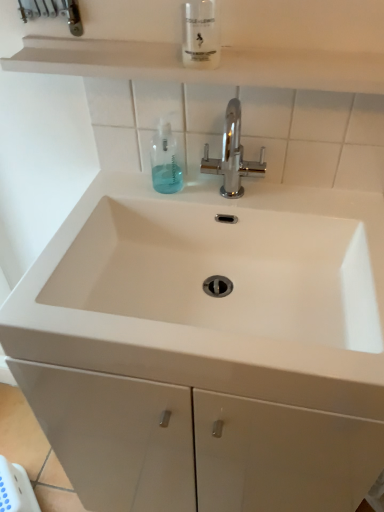
Measure the distance between point (334, 68) and camera.

Point (334, 68) is 26.42 inches away from camera.

Where is `translucent plastic mouthwash at center, which is counted as the 2th mouthwash, starting from the right`? The width and height of the screenshot is (384, 512). translucent plastic mouthwash at center, which is counted as the 2th mouthwash, starting from the right is located at coordinates (165, 160).

The width and height of the screenshot is (384, 512). What do you see at coordinates (201, 34) in the screenshot?
I see `clear plastic bottle at upper center, which is the 2th mouthwash from bottom to top` at bounding box center [201, 34].

Describe the element at coordinates (225, 271) in the screenshot. The height and width of the screenshot is (512, 384). I see `white matte sink at center` at that location.

Where is `white matte shelf at upper center`? white matte shelf at upper center is located at coordinates (201, 69).

Is white matte sink at center at the back of translucent plastic mouthwash at center, the first mouthwash ordered from the bottom?

No, translucent plastic mouthwash at center, the first mouthwash ordered from the bottom, is not facing the opposite direction of white matte sink at center.

Is translucent plastic mouthwash at center, acting as the 1th mouthwash starting from the left, wider than white matte sink at center?

No.

The image size is (384, 512). I want to click on sink that appears below the translucent plastic mouthwash at center, which is counted as the 2th mouthwash, starting from the right (from the image's perspective), so click(225, 271).

Looking at this image, can you confirm if translucent plastic mouthwash at center, acting as the 1th mouthwash starting from the left, is taller than white matte sink at center?

Yes, translucent plastic mouthwash at center, acting as the 1th mouthwash starting from the left, is taller than white matte sink at center.

Is chrome metallic faucet at center touching white matte sink at center?

No, chrome metallic faucet at center is not in contact with white matte sink at center.

Which object is positioned more to the right, chrome metallic faucet at center or white matte sink at center?

Positioned to the right is chrome metallic faucet at center.

From the image's perspective, which is above, chrome metallic faucet at center or white matte sink at center?

chrome metallic faucet at center is shown above in the image.

From a real-world perspective, which object stands above the other?

From a 3D spatial view, chrome metallic faucet at center is above.

Is clear plastic bottle at upper center, the second mouthwash viewed from the left, located outside translucent plastic mouthwash at center, which is counted as the 2th mouthwash, starting from the right?

clear plastic bottle at upper center, the second mouthwash viewed from the left, lies outside translucent plastic mouthwash at center, which is counted as the 2th mouthwash, starting from the right,'s area.

From the picture: Which is behind, clear plastic bottle at upper center, the first mouthwash from the front, or translucent plastic mouthwash at center, which is counted as the 1th mouthwash, starting from the back?

Positioned behind is translucent plastic mouthwash at center, which is counted as the 1th mouthwash, starting from the back.

Which is less distant, (207, 23) or (165, 131)?

The point (207, 23) is in front.

Is clear plastic bottle at upper center, which is the first mouthwash from top to bottom, placed right next to translucent plastic mouthwash at center, placed as the 2th mouthwash when sorted from top to bottom?

clear plastic bottle at upper center, which is the first mouthwash from top to bottom, is not next to translucent plastic mouthwash at center, placed as the 2th mouthwash when sorted from top to bottom, and they're not touching.

Does point (155, 271) come farther from viewer compared to point (353, 77)?

Yes, point (155, 271) is behind point (353, 77).

Who is more distant, white matte sink at center or white matte shelf at upper center?

white matte shelf at upper center is further from the camera.

In terms of width, does white matte sink at center look wider or thinner when compared to white matte shelf at upper center?

white matte sink at center is wider than white matte shelf at upper center.

From a real-world perspective, which is physically below, white matte sink at center or white matte shelf at upper center?

white matte sink at center.

Which object is positioned more to the left, chrome metallic faucet at center or clear plastic bottle at upper center, which is the 2th mouthwash from bottom to top?

clear plastic bottle at upper center, which is the 2th mouthwash from bottom to top.

Locate an element on the screen. tap located below the clear plastic bottle at upper center, the second mouthwash viewed from the left (from the image's perspective) is located at coordinates (232, 155).

From the image's perspective, is chrome metallic faucet at center located beneath clear plastic bottle at upper center, the 2th mouthwash positioned from the back?

Yes.

Is point (223, 137) less distant than point (214, 44)?

No, it is not.

Is chrome metallic faucet at center in front of or behind translucent plastic mouthwash at center, positioned as the second mouthwash in front-to-back order, in the image?

chrome metallic faucet at center is positioned closer to the viewer than translucent plastic mouthwash at center, positioned as the second mouthwash in front-to-back order.

From a real-world perspective, which object stands above the other?

From a 3D spatial view, chrome metallic faucet at center is above.

Is chrome metallic faucet at center at the right side of translucent plastic mouthwash at center, positioned as the second mouthwash in front-to-back order?

Indeed, chrome metallic faucet at center is positioned on the right side of translucent plastic mouthwash at center, positioned as the second mouthwash in front-to-back order.

Considering the sizes of objects chrome metallic faucet at center and translucent plastic mouthwash at center, which is counted as the 2th mouthwash, starting from the right, in the image provided, who is thinner, chrome metallic faucet at center or translucent plastic mouthwash at center, which is counted as the 2th mouthwash, starting from the right,?

Thinner between the two is translucent plastic mouthwash at center, which is counted as the 2th mouthwash, starting from the right.

Between clear plastic bottle at upper center, the first mouthwash from the front, and white matte shelf at upper center, which one appears on the right side from the viewer's perspective?

From the viewer's perspective, clear plastic bottle at upper center, the first mouthwash from the front, appears more on the right side.

Is the depth of clear plastic bottle at upper center, the first mouthwash from the front, greater than that of white matte shelf at upper center?

That is False.

From the image's perspective, which one is positioned higher, clear plastic bottle at upper center, which is the 1th mouthwash in right-to-left order, or white matte shelf at upper center?

clear plastic bottle at upper center, which is the 1th mouthwash in right-to-left order.

Where is `sink in front of the translucent plastic mouthwash at center, the first mouthwash ordered from the bottom`? Image resolution: width=384 pixels, height=512 pixels. sink in front of the translucent plastic mouthwash at center, the first mouthwash ordered from the bottom is located at coordinates (225, 271).

You are a GUI agent. You are given a task and a screenshot of the screen. Output one action in this format:
    pyautogui.click(x=<x>, y=<y>)
    Task: Click on the sink that is on the left side of chrome metallic faucet at center
    This screenshot has width=384, height=512.
    Given the screenshot: What is the action you would take?
    (x=225, y=271)

From the image, which object appears to be farther from white matte sink at center, white matte shelf at upper center or translucent plastic mouthwash at center, which is counted as the 1th mouthwash, starting from the back?

white matte shelf at upper center is positioned further to the anchor white matte sink at center.

When comparing their distances from chrome metallic faucet at center, does white matte shelf at upper center or translucent plastic mouthwash at center, acting as the 1th mouthwash starting from the left, seem closer?

translucent plastic mouthwash at center, acting as the 1th mouthwash starting from the left, is closer to chrome metallic faucet at center.

Looking at the image, which one is located closer to white matte sink at center, clear plastic bottle at upper center, the 2th mouthwash positioned from the back, or chrome metallic faucet at center?

chrome metallic faucet at center is positioned closer to the anchor white matte sink at center.

In the scene shown: Which object lies further to the anchor point chrome metallic faucet at center, clear plastic bottle at upper center, the second mouthwash viewed from the left, or translucent plastic mouthwash at center, acting as the 1th mouthwash starting from the left?

Among the two, clear plastic bottle at upper center, the second mouthwash viewed from the left, is located further to chrome metallic faucet at center.

Based on their spatial positions, is white matte shelf at upper center or chrome metallic faucet at center further from white matte sink at center?

white matte shelf at upper center is further to white matte sink at center.

From the image, which object appears to be nearer to white matte shelf at upper center, chrome metallic faucet at center or clear plastic bottle at upper center, which is the 2th mouthwash from bottom to top?

clear plastic bottle at upper center, which is the 2th mouthwash from bottom to top, is closer to white matte shelf at upper center.

Based on their spatial positions, is white matte shelf at upper center or clear plastic bottle at upper center, which is the 2th mouthwash from bottom to top, further from translucent plastic mouthwash at center, placed as the 2th mouthwash when sorted from top to bottom?

white matte shelf at upper center lies further to translucent plastic mouthwash at center, placed as the 2th mouthwash when sorted from top to bottom, than the other object.

In the scene shown: Based on their spatial positions, is clear plastic bottle at upper center, the first mouthwash from the front, or translucent plastic mouthwash at center, positioned as the second mouthwash in front-to-back order, closer to white matte sink at center?

translucent plastic mouthwash at center, positioned as the second mouthwash in front-to-back order.

Image resolution: width=384 pixels, height=512 pixels. Find the location of `mouthwash between clear plastic bottle at upper center, which is the 1th mouthwash in right-to-left order, and chrome metallic faucet at center, in the vertical direction`. mouthwash between clear plastic bottle at upper center, which is the 1th mouthwash in right-to-left order, and chrome metallic faucet at center, in the vertical direction is located at coordinates (165, 160).

Where is `shelve between clear plastic bottle at upper center, the second mouthwash viewed from the left, and white matte sink at center, in the vertical direction`? shelve between clear plastic bottle at upper center, the second mouthwash viewed from the left, and white matte sink at center, in the vertical direction is located at coordinates (201, 69).

Locate an element on the screen. This screenshot has height=512, width=384. shelve between clear plastic bottle at upper center, the 2th mouthwash positioned from the back, and chrome metallic faucet at center vertically is located at coordinates (201, 69).

The width and height of the screenshot is (384, 512). Find the location of `tap between clear plastic bottle at upper center, the 2th mouthwash positioned from the back, and white matte sink at center in the up-down direction`. tap between clear plastic bottle at upper center, the 2th mouthwash positioned from the back, and white matte sink at center in the up-down direction is located at coordinates (232, 155).